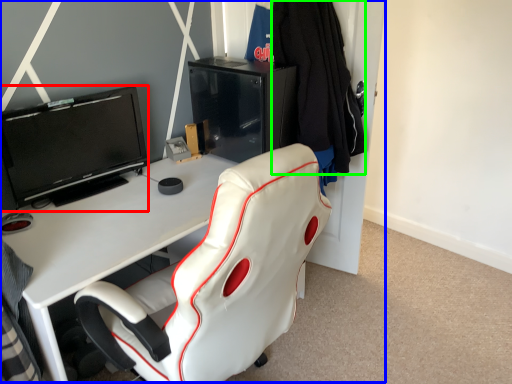
Question: Which object is positioned closest to television (highlighted by a red box)? Select from entertainment center (highlighted by a blue box) and clothing (highlighted by a green box).

Choices:
 (A) entertainment center
 (B) clothing

Answer: (B)